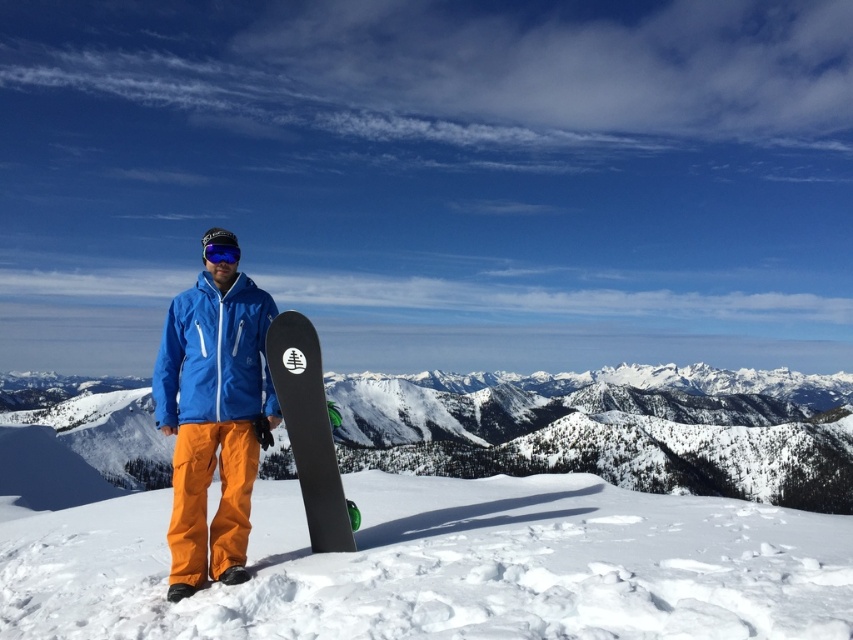
You are a photographer planning to take a photo of the snowy mountain at center and the black matte snowboard at center. Based on their positions, which object should you focus on first to ensure both are in sharp focus?

The snowy mountain at center is further to the viewer than the black matte snowboard at center, so you should focus on the snowy mountain at center first to ensure both are in sharp focus.

Based on the scene description, where is the point located at coordinates [612,428]?

The point at coordinates [612,428] is located at the snowy mountain at center.

You are planning to ski down from the snowy mountain at center. Your GPS shows that the distance from your current position to the base of the mountain is 55.19 meters. Is this distance sufficient for you to reach the base safely?

The distance between the snowy mountain at center and the camera is 55.19 meters, so yes, the distance is sufficient to reach the base safely.